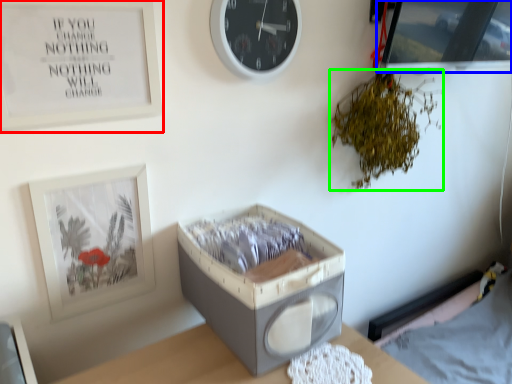
Question: Based on their relative distances, which object is nearer to picture frame (highlighted by a red box)? Choose from picture frame (highlighted by a blue box) and plant (highlighted by a green box).

Choices:
 (A) picture frame
 (B) plant

Answer: (B)